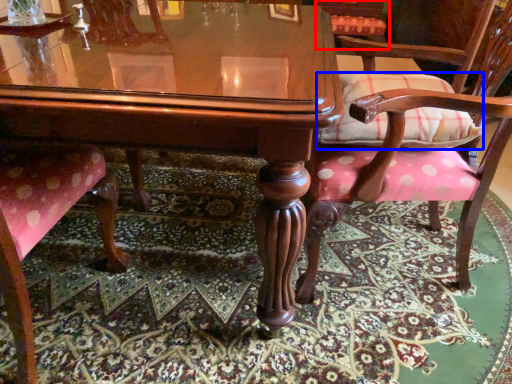
Question: Which object appears farthest to the camera in this image, chair (highlighted by a red box) or pillow (highlighted by a blue box)?

Choices:
 (A) chair
 (B) pillow

Answer: (A)